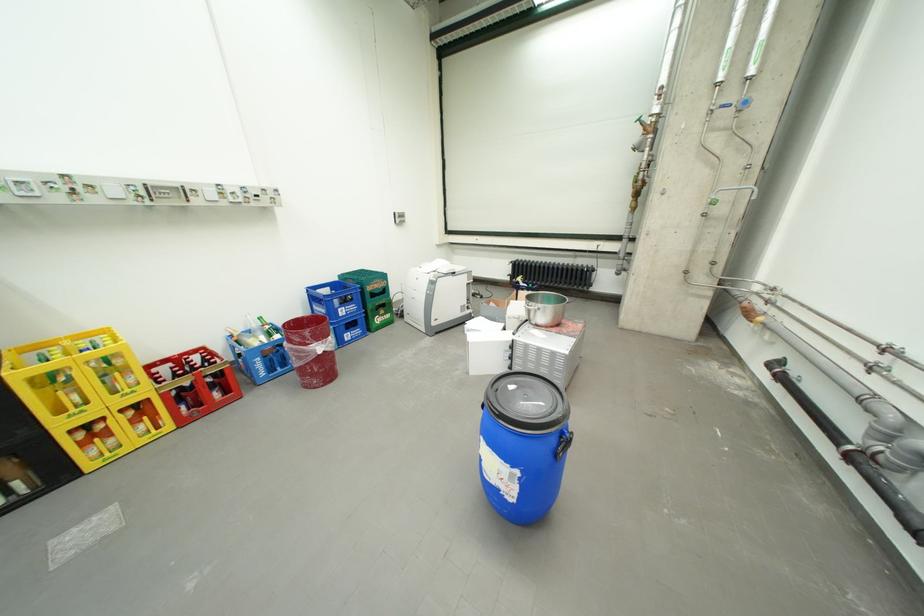
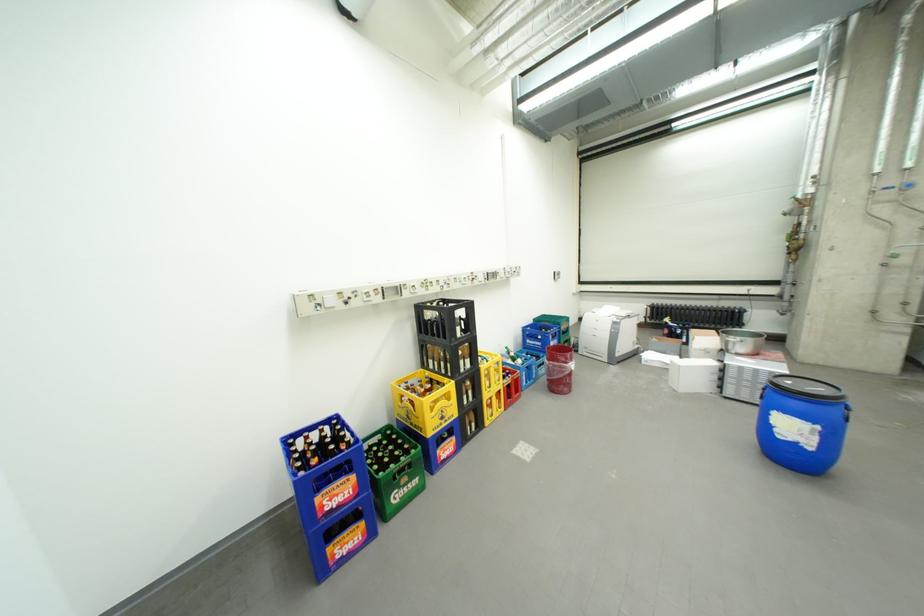
Locate, in the second image, the point that corresponds to point 543,323 in the first image.

(744, 353)